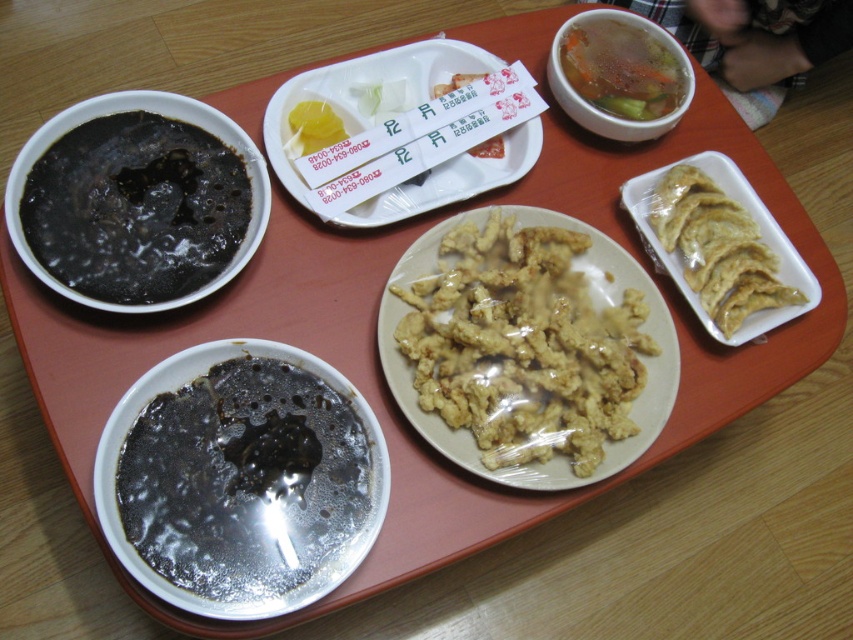
This screenshot has width=853, height=640. What do you see at coordinates (525, 349) in the screenshot? I see `golden crispy fried chicken at center` at bounding box center [525, 349].

The width and height of the screenshot is (853, 640). In order to click on golden crispy fried chicken at center in this screenshot , I will do `click(525, 349)`.

This screenshot has width=853, height=640. In order to click on golden crispy fried chicken at center in this screenshot , I will do `click(525, 349)`.

Can you confirm if clear broth with vegetables at upper right is shorter than yellow paper at center?

No.

Which of these two, clear broth with vegetables at upper right or yellow paper at center, stands taller?

clear broth with vegetables at upper right

The height and width of the screenshot is (640, 853). Identify the location of clear broth with vegetables at upper right. (621, 68).

Does point (506, 132) lie in front of point (668, 104)?

Yes, it is in front of point (668, 104).

Locate an element on the screen. The height and width of the screenshot is (640, 853). clear plastic tray at center is located at coordinates (364, 93).